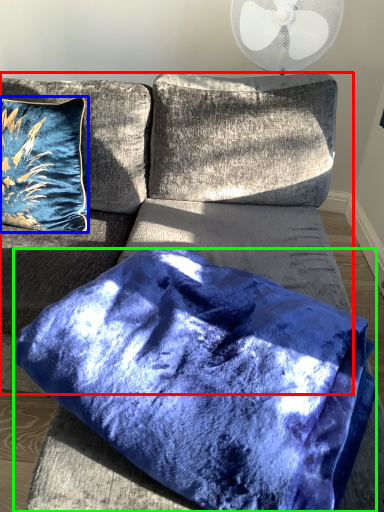
Question: Which object is positioned farthest from couch (highlighted by a red box)? Select from pillow (highlighted by a blue box) and pillow (highlighted by a green box).

Choices:
 (A) pillow
 (B) pillow

Answer: (B)